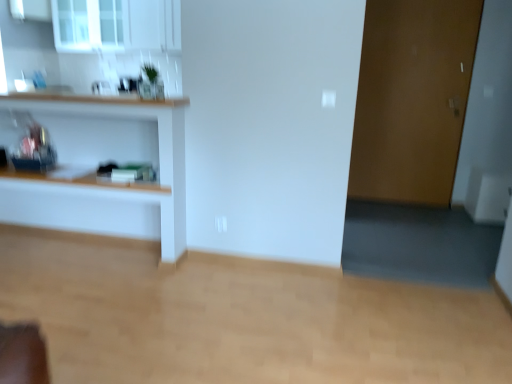
The image size is (512, 384). What do you see at coordinates (412, 99) in the screenshot? I see `brown matte door at right` at bounding box center [412, 99].

Image resolution: width=512 pixels, height=384 pixels. Identify the location of wooden shelf at left. (115, 183).

At what (x,y) coordinates should I click in order to perform the action: click on brown matte door at right. Please return your answer as a coordinate pair (x, y). The height and width of the screenshot is (384, 512). Looking at the image, I should click on (412, 99).

From the image's perspective, which object appears higher, brown matte door at right or transparent glass window at upper left?

transparent glass window at upper left.

From a real-world perspective, is brown matte door at right below transparent glass window at upper left?

Yes, from a real-world perspective, brown matte door at right is below transparent glass window at upper left.

Is brown matte door at right to the left of transparent glass window at upper left from the viewer's perspective?

Incorrect, brown matte door at right is not on the left side of transparent glass window at upper left.

Based on the photo, is brown matte door at right bigger than transparent glass window at upper left?

No.

What are the coordinates of `window behind the wooden shelf at left` in the screenshot? It's located at (88, 25).

Is wooden shelf at left taller than transparent glass window at upper left?

Yes, wooden shelf at left is taller than transparent glass window at upper left.

From the image's perspective, which one is positioned higher, wooden shelf at left or transparent glass window at upper left?

From the image's view, transparent glass window at upper left is above.

Consider the image. What's the angular difference between wooden shelf at left and transparent glass window at upper left's facing directions?

They differ by 1.44 degrees in their facing directions.

Is wooden shelf at left taller than brown matte door at right?

Incorrect, the height of wooden shelf at left is not larger of that of brown matte door at right.

Is wooden shelf at left further to the viewer compared to brown matte door at right?

No, wooden shelf at left is in front of brown matte door at right.

Considering the relative sizes of wooden shelf at left and brown matte door at right in the image provided, is wooden shelf at left wider than brown matte door at right?

Yes, wooden shelf at left is wider than brown matte door at right.

Considering the points (170, 137) and (399, 117), which point is behind, point (170, 137) or point (399, 117)?

The point (399, 117) is farther.

Looking at this image, looking at the image, does brown matte door at right seem bigger or smaller compared to wooden shelf at left?

brown matte door at right is smaller than wooden shelf at left.

Identify the location of shelf that is below the brown matte door at right (from the image's perspective). The image size is (512, 384). (115, 183).

From the image's perspective, does brown matte door at right appear higher than wooden shelf at left?

Correct, brown matte door at right appears higher than wooden shelf at left in the image.

From a real-world perspective, is brown matte door at right above or below wooden shelf at left?

Clearly, from a real-world perspective, brown matte door at right is above wooden shelf at left.

Which is more to the right, transparent glass window at upper left or brown matte door at right?

From the viewer's perspective, brown matte door at right appears more on the right side.

Is transparent glass window at upper left not within brown matte door at right?

Indeed, transparent glass window at upper left is completely outside brown matte door at right.

Are transparent glass window at upper left and brown matte door at right beside each other?

No, transparent glass window at upper left is not making contact with brown matte door at right.

Measure the distance from transparent glass window at upper left to wooden shelf at left.

transparent glass window at upper left and wooden shelf at left are 6.50 feet apart from each other.

From a real-world perspective, is transparent glass window at upper left physically located above or below wooden shelf at left?

Clearly, from a real-world perspective, transparent glass window at upper left is above wooden shelf at left.

Between transparent glass window at upper left and wooden shelf at left, which one has smaller size?

transparent glass window at upper left is smaller.

Based on the photo, is transparent glass window at upper left far from wooden shelf at left?

Indeed, transparent glass window at upper left is not near wooden shelf at left.

Find the location of a particular element. door lying on the right of transparent glass window at upper left is located at coordinates (412, 99).

This screenshot has width=512, height=384. Identify the location of window on the left of wooden shelf at left. (88, 25).

When comparing their distances from wooden shelf at left, does brown matte door at right or transparent glass window at upper left seem closer?

transparent glass window at upper left lies closer to wooden shelf at left than the other object.

Looking at the image, which one is located further to brown matte door at right, wooden shelf at left or transparent glass window at upper left?

Based on the image, transparent glass window at upper left appears to be further to brown matte door at right.

Looking at the image, which one is located further to brown matte door at right, transparent glass window at upper left or wooden shelf at left?

Based on the image, transparent glass window at upper left appears to be further to brown matte door at right.

Estimate the real-world distances between objects in this image. Which object is closer to transparent glass window at upper left, brown matte door at right or wooden shelf at left?

wooden shelf at left.

Looking at this image, estimate the real-world distances between objects in this image. Which object is further from transparent glass window at upper left, wooden shelf at left or brown matte door at right?

brown matte door at right is further to transparent glass window at upper left.

Which object lies further to the anchor point wooden shelf at left, transparent glass window at upper left or brown matte door at right?

Based on the image, brown matte door at right appears to be further to wooden shelf at left.

Where is `shelf located between transparent glass window at upper left and brown matte door at right in the left-right direction`? This screenshot has width=512, height=384. shelf located between transparent glass window at upper left and brown matte door at right in the left-right direction is located at coordinates (115, 183).